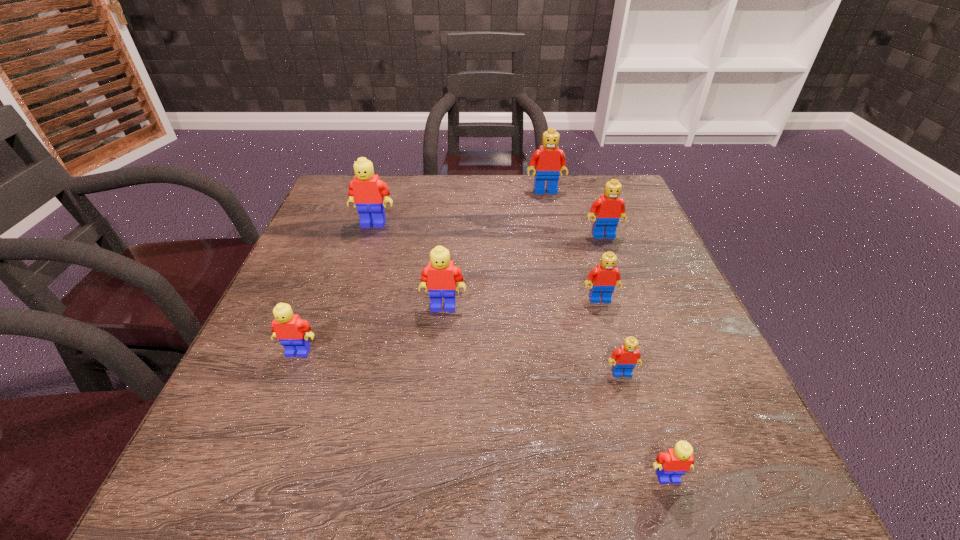
Find the location of a particular element. This screenshot has width=960, height=540. the third biggest yellow Lego is located at coordinates (292, 332).

The image size is (960, 540). Find the location of `the nearest red Lego`. the nearest red Lego is located at coordinates (624, 359).

Find the location of a particular element. the second nearest Lego is located at coordinates (624, 359).

Where is `the nearest object`? the nearest object is located at coordinates (674, 463).

What are the coordinates of `the nearest yellow Lego` in the screenshot? It's located at [674, 463].

This screenshot has width=960, height=540. What are the coordinates of `blank area located 0.400m on the face of the farthest object` in the screenshot? It's located at (567, 291).

In order to click on vacant space located on the front-facing side of the seventh nearest Lego in this screenshot , I will do `click(359, 269)`.

Where is `vacant point located 0.330m on the face of the third farthest Lego`? vacant point located 0.330m on the face of the third farthest Lego is located at coordinates (641, 342).

I want to click on vacant region located on the front-facing side of the second farthest yellow Lego, so click(439, 355).

Identify the location of free space located on the face of the third farthest red Lego. This screenshot has width=960, height=540. (642, 444).